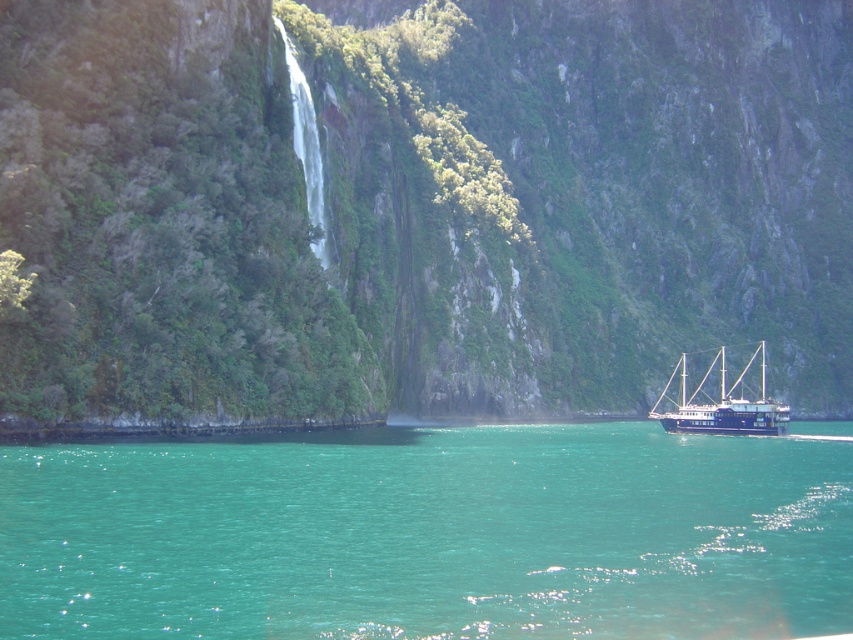
You are standing at the point closest to the viewer in the image. Which point, point [518,467] or point [766,429], are you standing at?

You are standing at point [518,467] because it is in front of point [766,429].

You are a drone operator trying to capture a photo of the green mossy cliff at center. The drone has a GPS coordinate system where the bottom left corner is the origin point. The cliff is located at point A. Where should you position the drone to capture the cliff in the center of the photo?

The green mossy cliff at center is located at point A with coordinates (421, 204). To center the cliff in the photo, position the drone so that the camera is aimed directly at point A.

You are standing on the edge of the deep turquoise water and want to reach the green mossy cliff at center. If your maximum jumping distance is 60 meters, can you jump to the cliff?

The green mossy cliff at center is 62.46 meters away from the viewer, which exceeds your maximum jumping distance of 60 meters. Therefore, you cannot jump to the cliff.